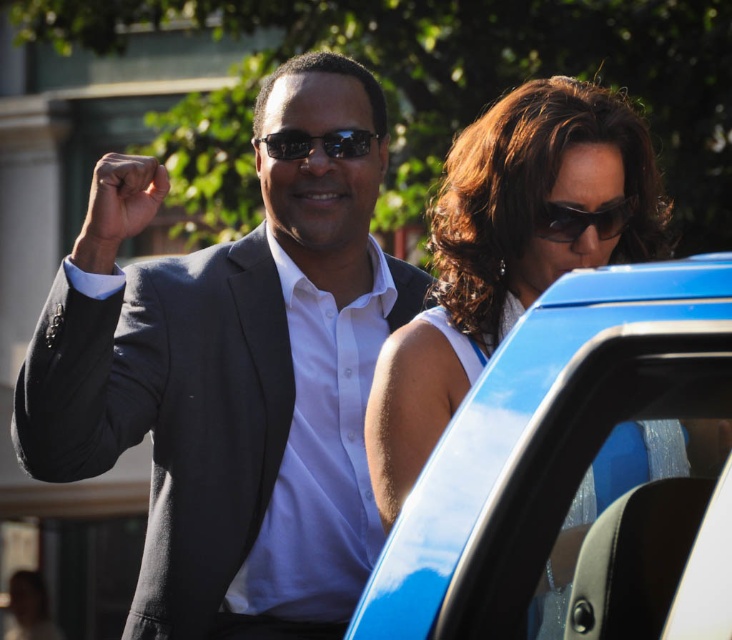
Between sunglasses at center and black reflective sunglasses at center, which one has less height?

black reflective sunglasses at center is shorter.

Is point (564, 230) behind point (347, 156)?

No, it is not.

Which is behind, point (569, 208) or point (283, 140)?

Point (283, 140)

You are a GUI agent. You are given a task and a screenshot of the screen. Output one action in this format:
    pyautogui.click(x=<x>, y=<y>)
    Task: Click on the sunglasses at center
    
    Given the screenshot: What is the action you would take?
    pyautogui.click(x=582, y=220)

Which of these two, blue glossy car door at center-right or black reflective sunglasses at center, stands shorter?

blue glossy car door at center-right

Find the location of a particular element. blue glossy car door at center-right is located at coordinates (515, 424).

Image resolution: width=732 pixels, height=640 pixels. I want to click on blue glossy car door at center-right, so click(x=515, y=424).

Who is positioned more to the right, matte black suit at center or black reflective sunglasses at center?

From the viewer's perspective, black reflective sunglasses at center appears more on the right side.

Which is in front, point (168, 560) or point (274, 148)?

Point (168, 560) is in front.

Where is `matte black suit at center`? matte black suit at center is located at coordinates [234, 376].